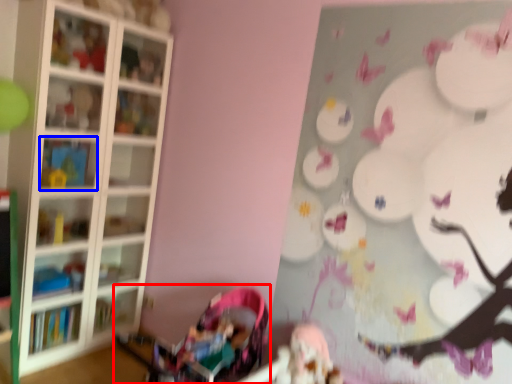
Question: Which object is further to the camera taking this photo, baby carriage (highlighted by a red box) or shelf (highlighted by a blue box)?

Choices:
 (A) baby carriage
 (B) shelf

Answer: (B)